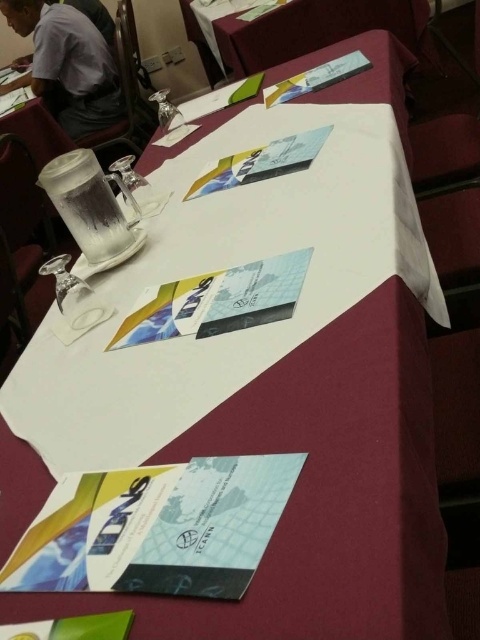
Between point (315, 29) and point (99, 120), which one is positioned in front?

Point (315, 29) is more forward.

Does white paper at upper center appear over gray fabric shirt at upper left?

Incorrect, white paper at upper center is not positioned above gray fabric shirt at upper left.

Measure the distance between point (x=220, y=20) and camera.

2.62 meters

At what (x,y) coordinates should I click in order to perform the action: click on white paper at upper center. Please return your answer as a coordinate pair (x, y). This screenshot has width=480, height=640. Looking at the image, I should click on (303, 32).